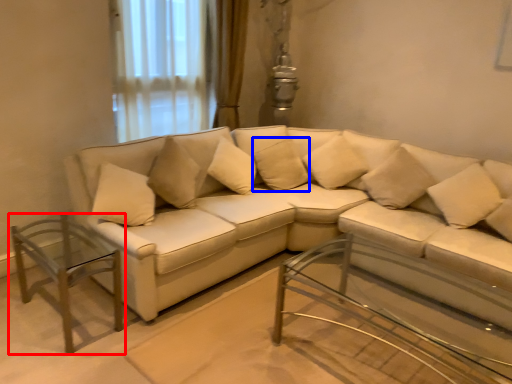
Question: Which of the following is the farthest to the observer, table (highlighted by a red box) or pillow (highlighted by a blue box)?

Choices:
 (A) table
 (B) pillow

Answer: (B)